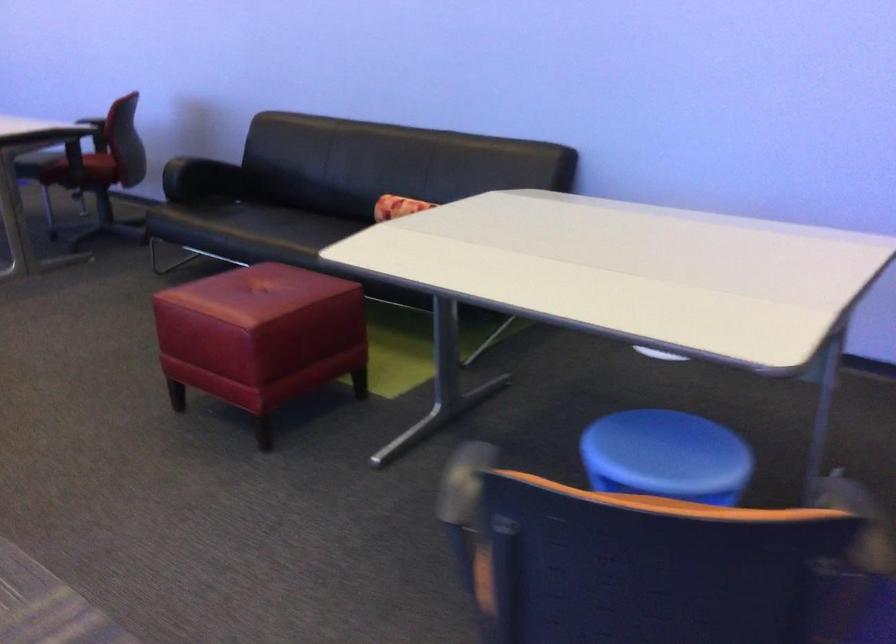
Locate an element on the screen. The width and height of the screenshot is (896, 644). sofa armrest is located at coordinates point(178,167).